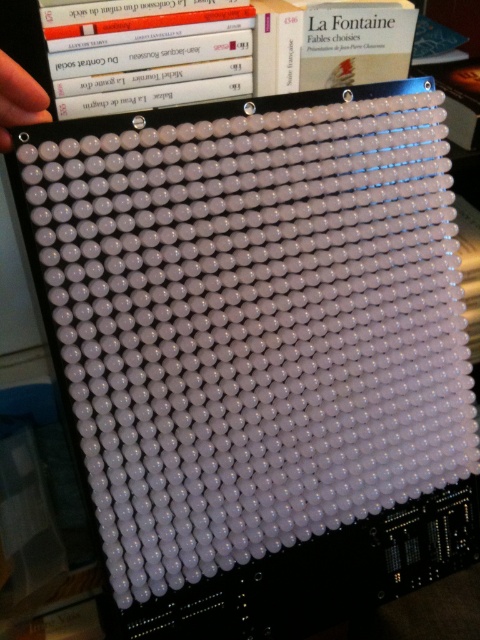
Question: Where is hardcover book at upper center located in relation to white matte hand at upper left in the image?

Choices:
 (A) right
 (B) left

Answer: (A)

Question: Which point is closer to the camera taking this photo?

Choices:
 (A) (6, 108)
 (B) (247, 8)

Answer: (A)

Question: In this image, where is hardcover book at upper center located relative to white matte hand at upper left?

Choices:
 (A) above
 (B) below

Answer: (A)

Question: Can you confirm if hardcover book at upper center is wider than white matte hand at upper left?

Choices:
 (A) no
 (B) yes

Answer: (B)